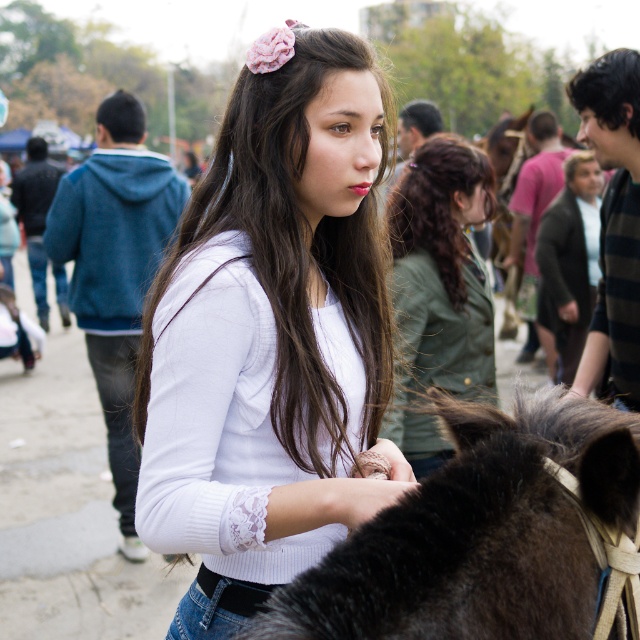
Question: Is dark brown fur at center to the left of white lace shirt at center from the viewer's perspective?

Choices:
 (A) no
 (B) yes

Answer: (B)

Question: Which point is closer to the camera taking this photo?

Choices:
 (A) (396, 598)
 (B) (314, 554)
 (C) (435, 321)

Answer: (A)

Question: Which point appears farthest from the camera in this image?

Choices:
 (A) (323, 51)
 (B) (451, 193)
 (C) (548, 428)

Answer: (B)

Question: Can you confirm if white lace sweater at center is bigger than white lace shirt at center?

Choices:
 (A) yes
 (B) no

Answer: (B)

Question: In this image, where is dark brown fur at center located relative to white lace shirt at center?

Choices:
 (A) left
 (B) right

Answer: (A)

Question: Which point is closer to the camera?

Choices:
 (A) dark brown fur at center
 (B) dark brown silky hair at center
 (C) white lace shirt at center

Answer: (A)